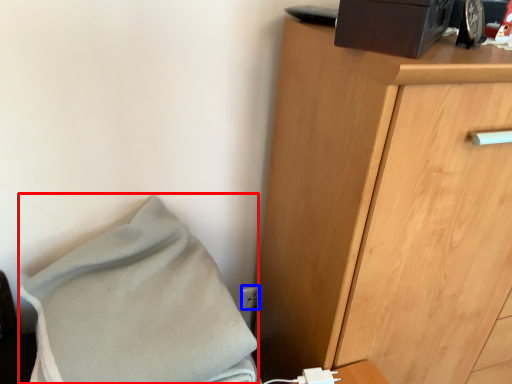
Question: Which object appears farthest to the camera in this image, blanket (highlighted by a red box) or electric outlet (highlighted by a blue box)?

Choices:
 (A) blanket
 (B) electric outlet

Answer: (B)